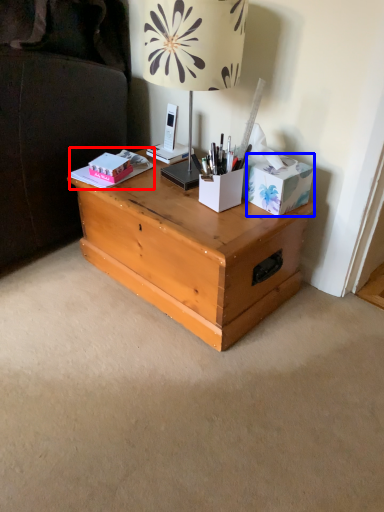
Question: Which point is closer to the camera, book (highlighted by a red box) or cardboard box (highlighted by a blue box)?

Choices:
 (A) book
 (B) cardboard box

Answer: (B)